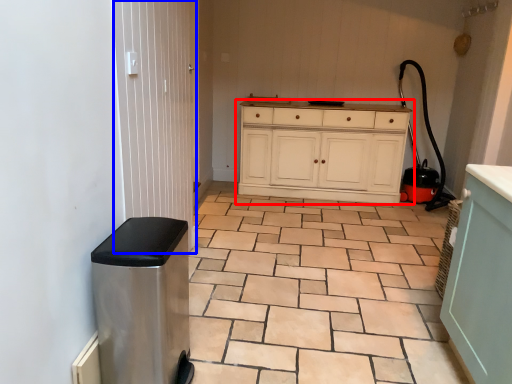
Question: Which point is further to the camera, chest of drawers (highlighted by a red box) or screen door (highlighted by a blue box)?

Choices:
 (A) chest of drawers
 (B) screen door

Answer: (A)